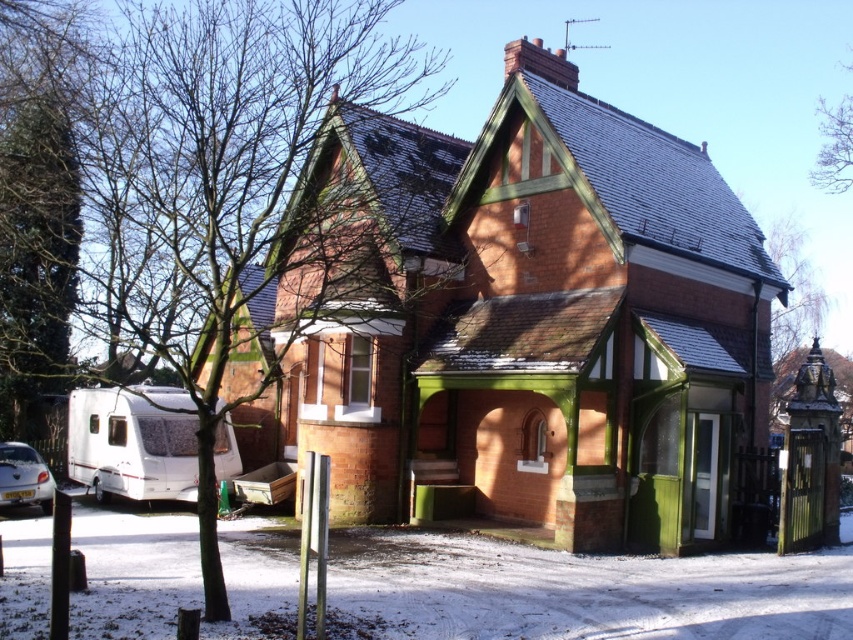
Can you confirm if white textured van at lower left is wider than metallic silver car at lower left?

In fact, white textured van at lower left might be narrower than metallic silver car at lower left.

Locate an element on the screen. white textured van at lower left is located at coordinates (132, 442).

Locate an element on the screen. This screenshot has height=640, width=853. white textured van at lower left is located at coordinates (132, 442).